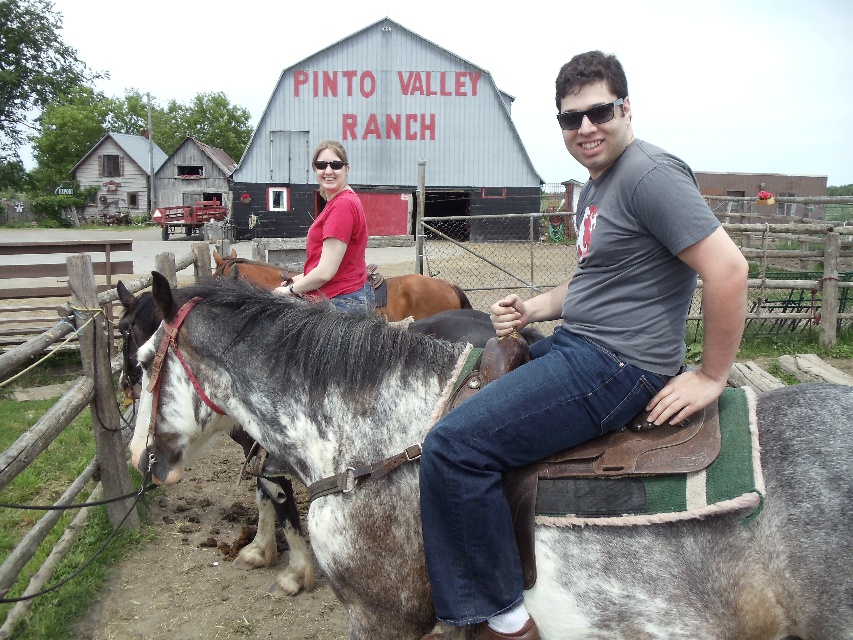
Question: Can you confirm if speckled leather saddle at center is smaller than brown leather saddle at center?

Choices:
 (A) no
 (B) yes

Answer: (A)

Question: Which of the following is the farthest from the observer?

Choices:
 (A) (433, 289)
 (B) (335, 193)
 (C) (577, 262)

Answer: (A)

Question: Estimate the real-world distances between objects in this image. Which object is closer to the matte red shirt at center?

Choices:
 (A) sunglasses at upper center
 (B) speckled leather saddle at center
 (C) brown leather saddle at center
 (D) matte gray shirt at center

Answer: (B)

Question: Is matte gray shirt at center in front of sunglasses at upper center?

Choices:
 (A) no
 (B) yes

Answer: (B)

Question: Considering the real-world distances, which object is farthest from the matte gray shirt at center?

Choices:
 (A) sunglasses at upper center
 (B) matte red shirt at center
 (C) brown leather saddle at center

Answer: (C)

Question: Can you confirm if speckled leather saddle at center is positioned below matte red shirt at center?

Choices:
 (A) yes
 (B) no

Answer: (A)